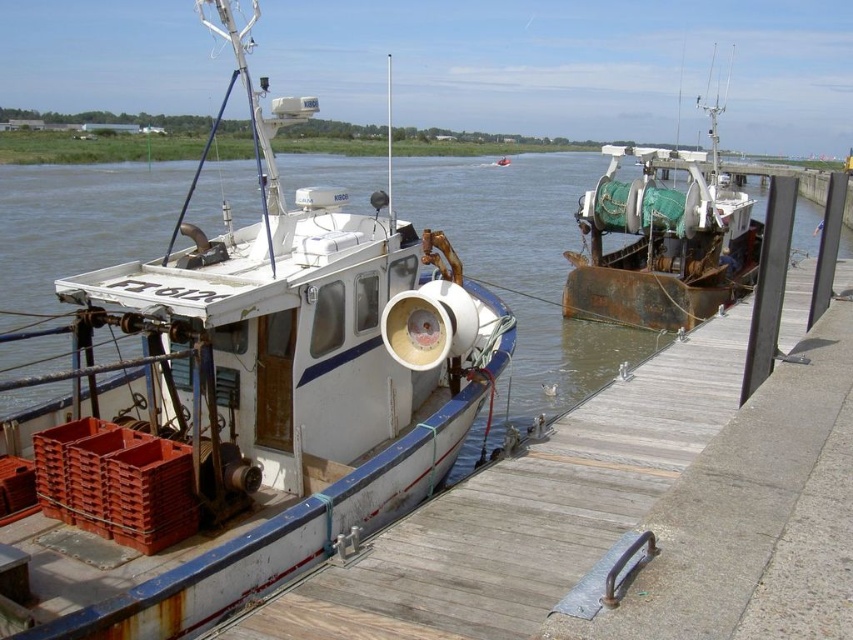
Measure the distance between white matte boat at center and rusty metal boat at right.

white matte boat at center and rusty metal boat at right are 13.04 meters apart.

Who is positioned more to the right, white matte boat at center or rusty metal boat at right?

rusty metal boat at right is more to the right.

Between point (268, 515) and point (646, 248), which one is positioned in front?

Positioned in front is point (268, 515).

The image size is (853, 640). In order to click on white matte boat at center in this screenshot , I will do `click(241, 404)`.

Is wooden at left to the right of rusty metal boat at right from the viewer's perspective?

Incorrect, wooden at left is not on the right side of rusty metal boat at right.

Which is behind, point (469, 548) or point (646, 186)?

Point (646, 186)

Locate an element on the screen. The height and width of the screenshot is (640, 853). wooden at left is located at coordinates (526, 509).

Is white matte boat at center taller than wooden at left?

Yes.

Does white matte boat at center come in front of wooden at left?

Yes, it is.

Image resolution: width=853 pixels, height=640 pixels. I want to click on white matte boat at center, so click(241, 404).